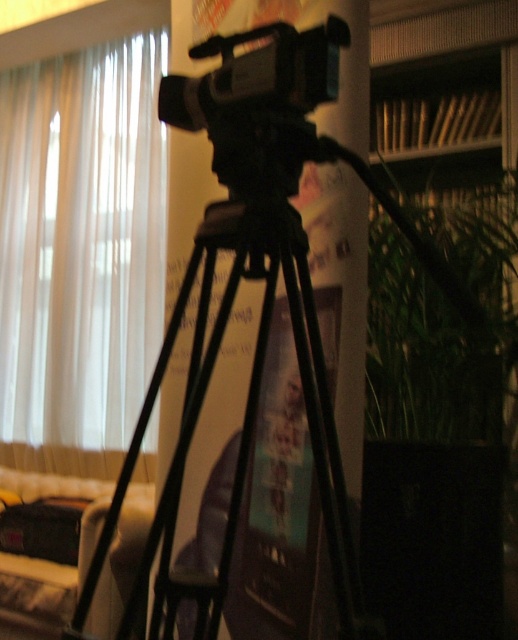
Does white sheer curtain at left lie in front of black plastic camera at center?

No, white sheer curtain at left is behind black plastic camera at center.

Can you confirm if white sheer curtain at left is positioned above black plastic camera at center?

Incorrect, white sheer curtain at left is not positioned above black plastic camera at center.

Does point (31, 90) lie in front of point (186, 76)?

No, (31, 90) is further to viewer.

Identify the location of white sheer curtain at left. Image resolution: width=518 pixels, height=640 pixels. (80, 248).

Can you confirm if green leafy plant at right is positioned below black plastic camera at center?

Correct, green leafy plant at right is located below black plastic camera at center.

Is green leafy plant at right to the right of black plastic camera at center from the viewer's perspective?

Correct, you'll find green leafy plant at right to the right of black plastic camera at center.

You are a GUI agent. You are given a task and a screenshot of the screen. Output one action in this format:
    pyautogui.click(x=<x>, y=<y>)
    Task: Click on the green leafy plant at right
    Image resolution: width=518 pixels, height=640 pixels.
    Given the screenshot: What is the action you would take?
    pyautogui.click(x=441, y=308)

Which is in front, point (67, 365) or point (306, 321)?

Point (306, 321) is more forward.

Can you confirm if white sheer curtain at left is positioned below black matte tripod at center?

Incorrect, white sheer curtain at left is not positioned below black matte tripod at center.

Who is more forward, (81,124) or (194,579)?

Point (194,579) is more forward.

Image resolution: width=518 pixels, height=640 pixels. What are the coordinates of `white sheer curtain at left` in the screenshot? It's located at (80, 248).